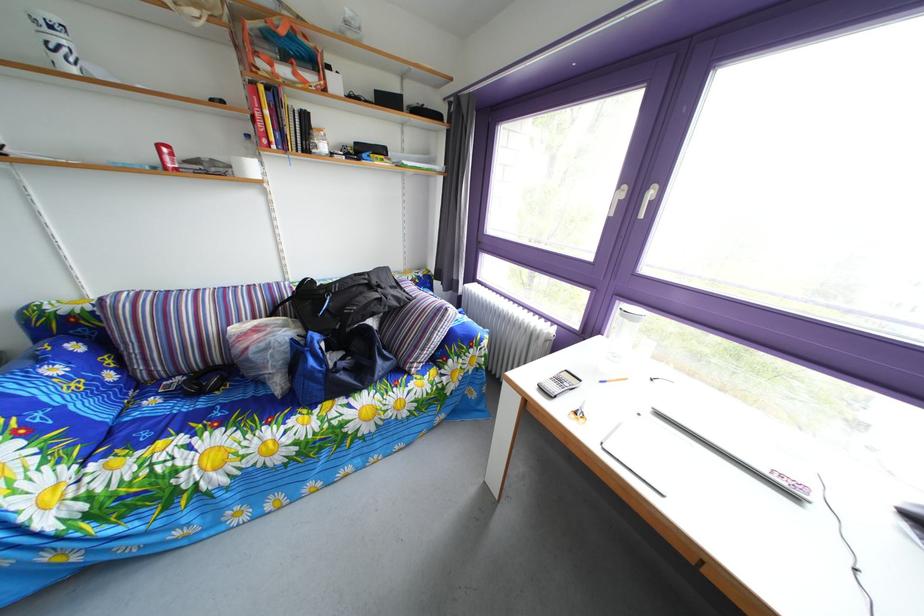
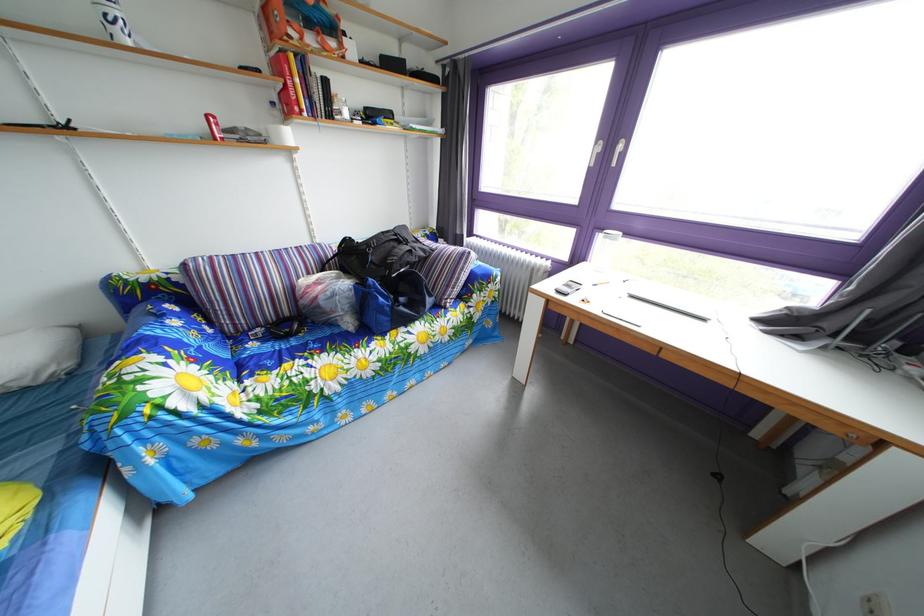
The point at (259, 145) is marked in the first image. Where is the corresponding point in the second image?

(284, 111)